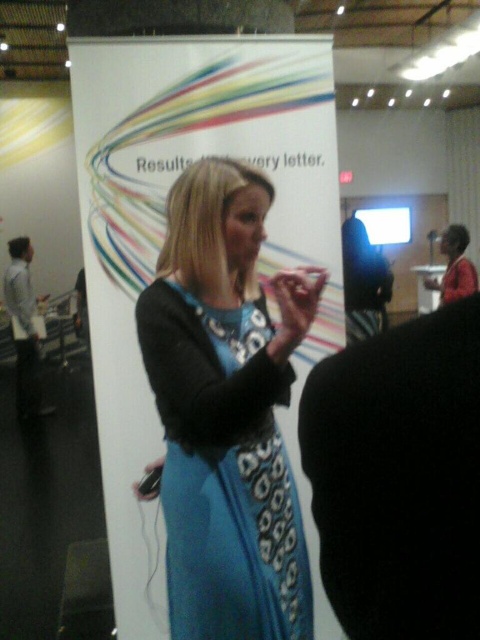
You are organizing a conference and need to place a new decorative item at position coordinates 0.4, 0.35. Is there already an object at that location based on the white paper at center?

The white paper at center is located at point [164,236], which is very close to the desired coordinates [168,256]. Therefore, placing the new item there may overlap with the white paper at center.

You are a photographer standing at the front of the conference room. You want to take a closeup shot of the white paper at center. Can you reach it without moving from your current position if your camera has a zoom range of 2 meters?

The white paper at center is 1.79 meters away from the camera. Since the camera has a zoom range of 2 meters, you can zoom in to capture a closeup of the white paper at center without moving from your current position.

You are organizing a presentation and need to hand out a document to the audience. You see the white paper at center and the blue printed fabric dress at center. Which object is closer to you, and why?

The white paper at center is closer to you because the blue printed fabric dress at center is behind it.